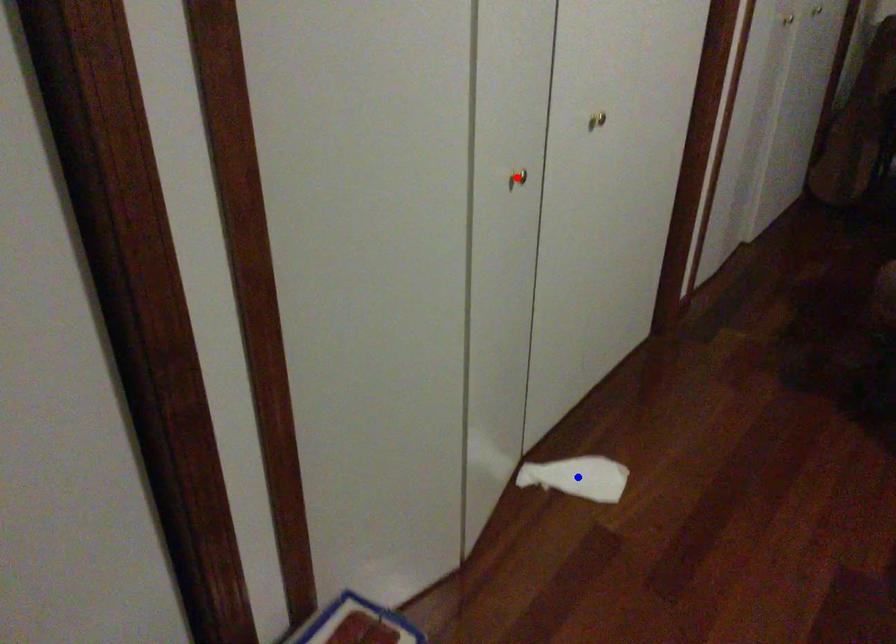
Question: In the image, two points are highlighted. Which point is nearer to the camera? Reply with the corresponding letter.

Choices:
 (A) blue point
 (B) red point

Answer: (B)